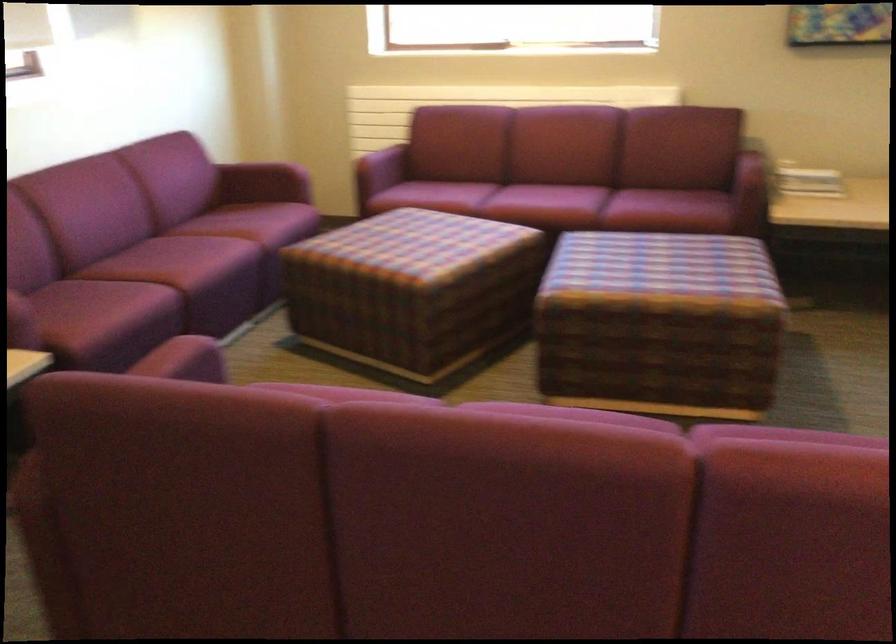
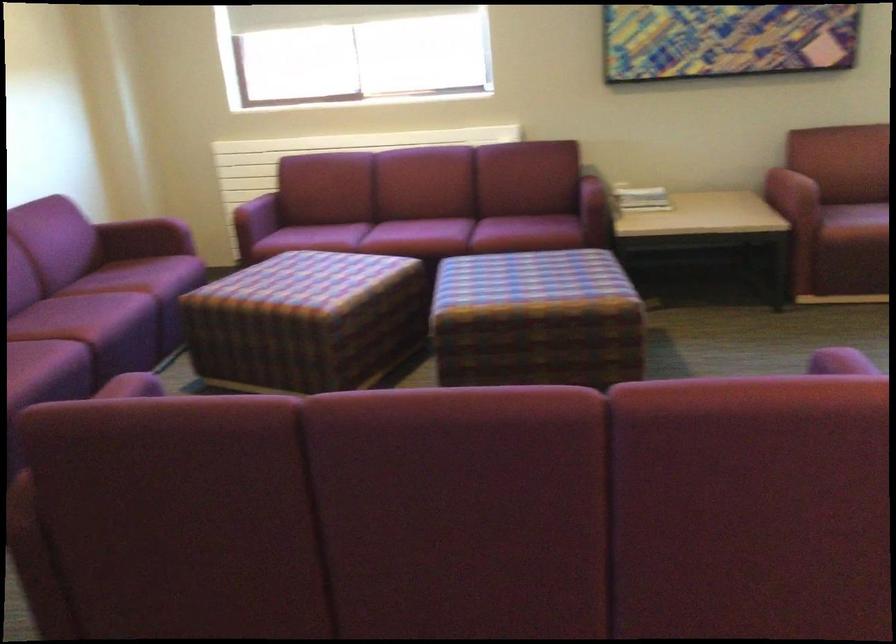
Question: Based on the continuous images, in which direction is the camera rotating? Reply with the corresponding letter.

Choices:
 (A) Left
 (B) Right
 (C) Up
 (D) Down

Answer: (B)